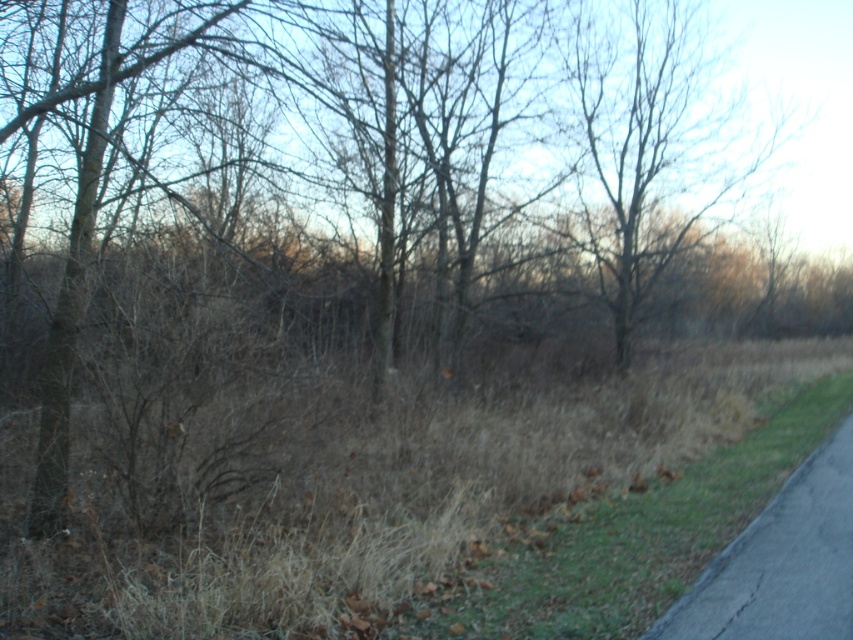
You are standing at the center of the image and want to walk to the brown dry grass at lower right. What direction should you move relative to your current position?

The brown dry grass at lower right is located at coordinates point (630, 538), so you should move towards the lower right direction from your current position at the center.

You are a hiker who wants to cross from the brown dry grass at lower left to the black asphalt bike path at lower right. Is there a direct path between them without stepping on any other objects?

The brown dry grass at lower left is positioned over the black asphalt bike path at lower right, so yes, you can directly step from the brown dry grass at lower left onto the black asphalt bike path at lower right without needing to go around.

You are standing at the bottom right corner of the image, where the paved road begins. You notice the brown dry grass at lower right and the black asphalt bike path at lower right. Which object is positioned more to the right side?

The brown dry grass at lower right is to the right of the black asphalt bike path at lower right, so the brown dry grass at lower right is positioned more to the right side.